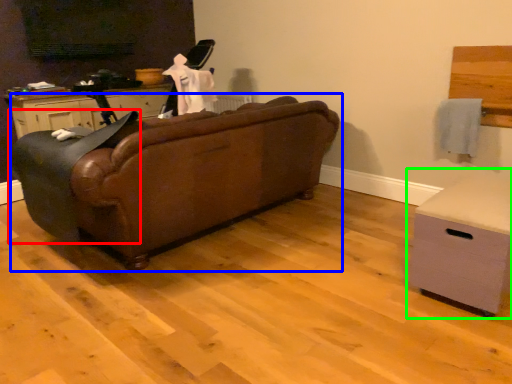
Question: Considering the real-world distances, which object is farthest from rocking chair (highlighted by a red box)? studio couch (highlighted by a blue box) or chest of drawers (highlighted by a green box)?

Choices:
 (A) studio couch
 (B) chest of drawers

Answer: (B)